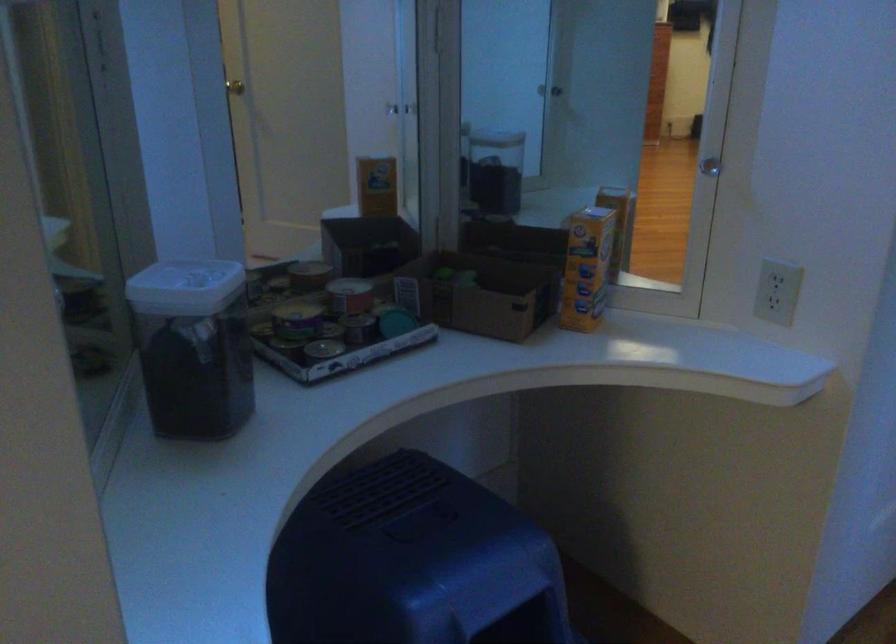
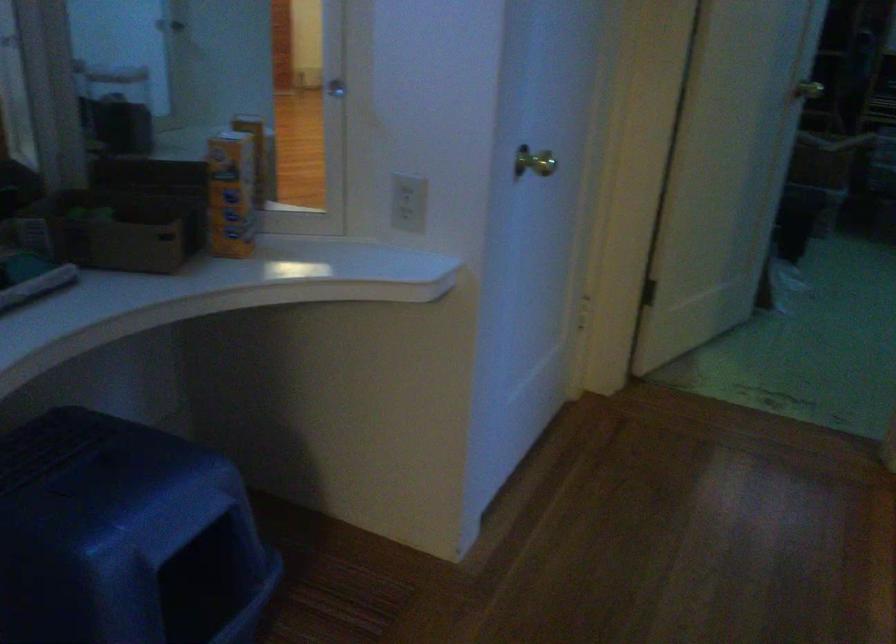
The images are taken continuously from a first-person perspective. In which direction are you moving?

The cameraman moved toward left, backward.